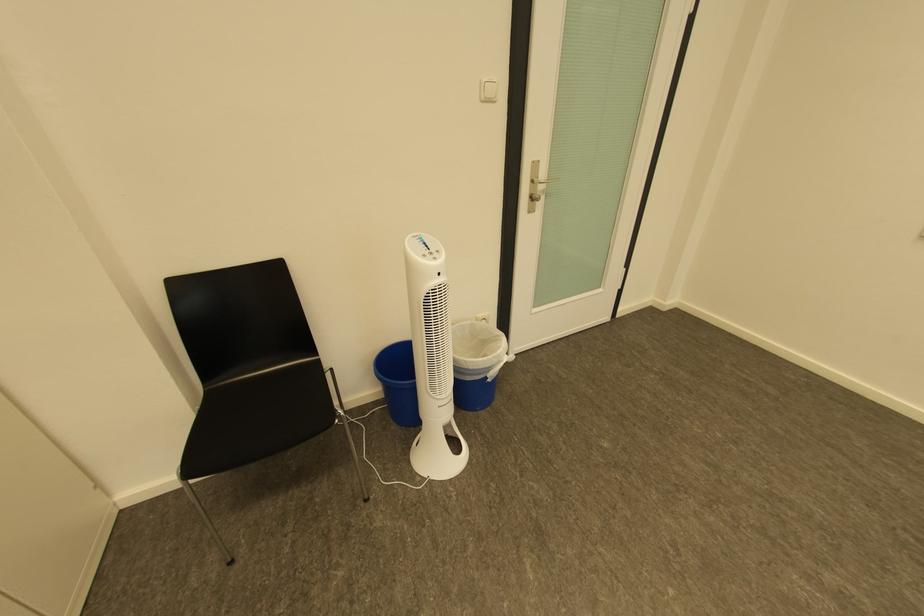
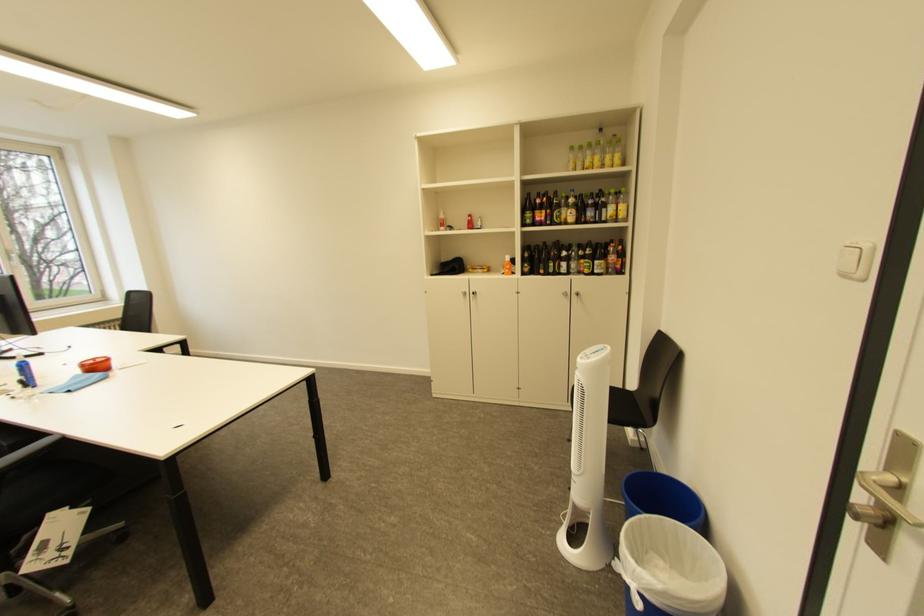
Where in the second image is the point corresponding to point (509, 363) from the first image?

(636, 570)